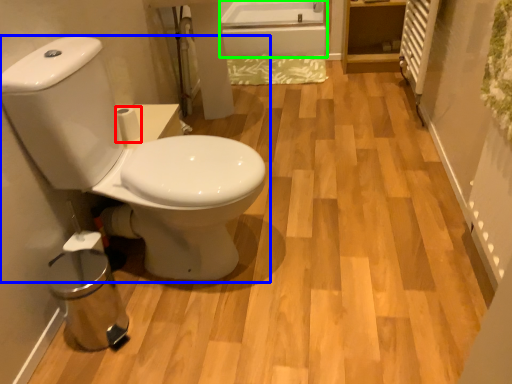
Question: Estimate the real-world distances between objects in this image. Which object is farther from toilet paper (highlighted by a red box), toilet (highlighted by a blue box) or bath (highlighted by a green box)?

Choices:
 (A) toilet
 (B) bath

Answer: (B)